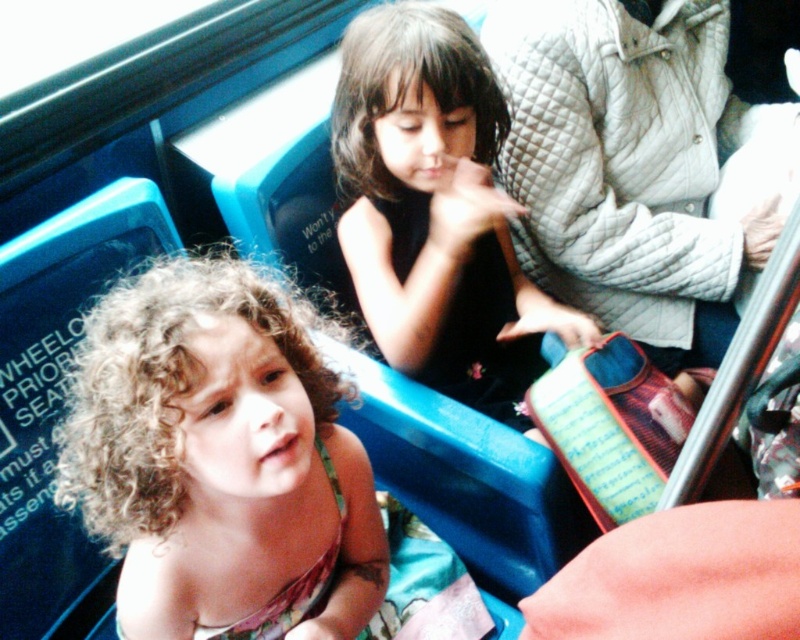
Question: Which object appears farthest from the camera in this image?

Choices:
 (A) black matte dress at center
 (B) white quilted jacket at upper right

Answer: (B)

Question: Which point is closer to the camera taking this photo?

Choices:
 (A) (90, 397)
 (B) (441, 266)

Answer: (A)

Question: Can you confirm if white quilted jacket at upper right is positioned below black matte dress at center?

Choices:
 (A) no
 (B) yes

Answer: (A)

Question: Can you confirm if curly hair at center is smaller than black matte dress at center?

Choices:
 (A) no
 (B) yes

Answer: (B)

Question: Does curly hair at center have a lesser width compared to white quilted jacket at upper right?

Choices:
 (A) yes
 (B) no

Answer: (A)

Question: Which object is positioned farthest from the black matte dress at center?

Choices:
 (A) white quilted jacket at upper right
 (B) curly hair at center

Answer: (B)